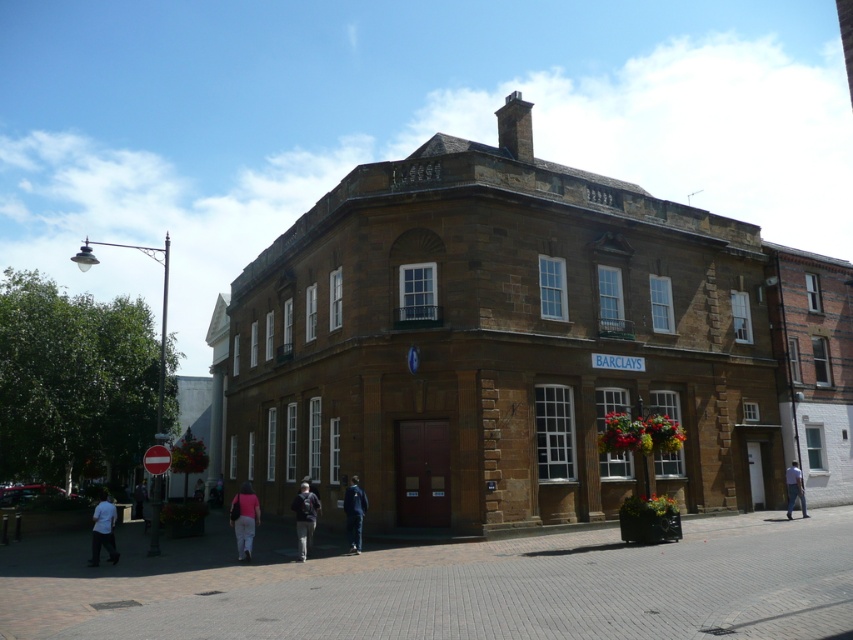
Between matte pink shirt at lower center and dark gray jacket at center, which one is positioned higher?

dark gray jacket at center

Where is `matte pink shirt at lower center`? Image resolution: width=853 pixels, height=640 pixels. matte pink shirt at lower center is located at coordinates (245, 518).

The width and height of the screenshot is (853, 640). I want to click on matte pink shirt at lower center, so click(245, 518).

Does dark gray jacket at center appear under pink fabric at lower center?

Actually, dark gray jacket at center is above pink fabric at lower center.

Is point (311, 520) positioned before point (192, 497)?

Yes, it is in front of point (192, 497).

In order to click on dark gray jacket at center in this screenshot , I will do `click(305, 516)`.

Does dark blue jacket at center have a greater height compared to pink fabric at lower center?

Yes, dark blue jacket at center is taller than pink fabric at lower center.

Between dark blue jacket at center and pink fabric at lower center, which one is positioned higher?

Positioned higher is dark blue jacket at center.

The image size is (853, 640). What do you see at coordinates (354, 513) in the screenshot?
I see `dark blue jacket at center` at bounding box center [354, 513].

I want to click on dark blue jacket at center, so click(354, 513).